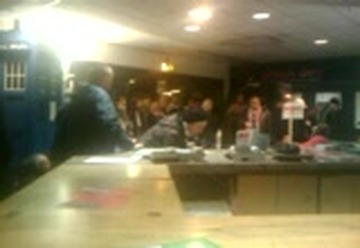
Identify the location of recessed ceiling lights. (x=262, y=15), (x=324, y=41), (x=205, y=11), (x=193, y=29).